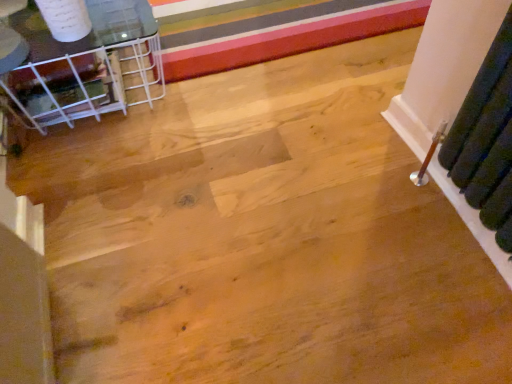
The width and height of the screenshot is (512, 384). I want to click on space that is in front of multicolored striped carpet at upper center, so click(x=264, y=99).